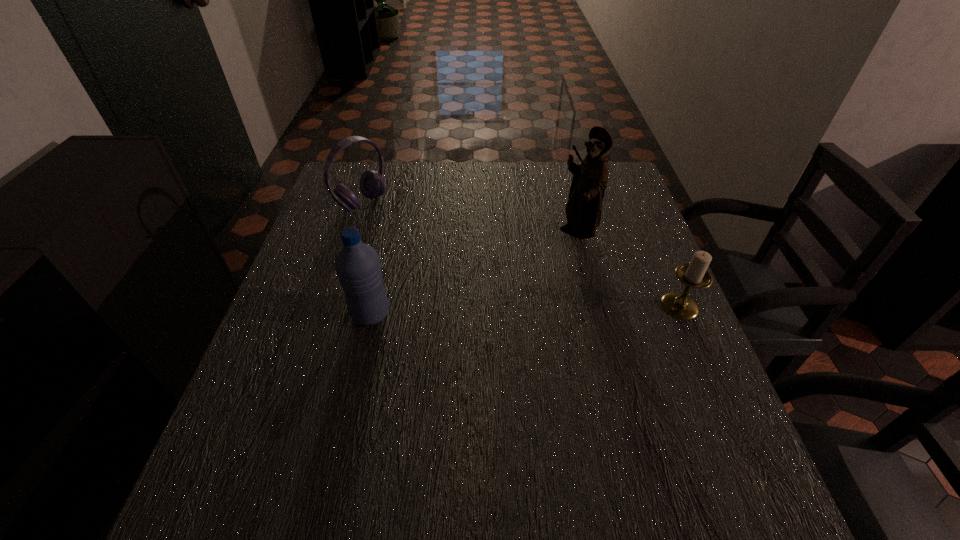
Locate an element on the screen. free space located 0.190m on the headband and ear cups of the headset is located at coordinates (420, 243).

Find the location of a particular element. The width and height of the screenshot is (960, 540). vacant space situated on the headband and ear cups of the headset is located at coordinates (416, 240).

Identify the location of vacant space situated 0.360m on the front-facing side of the tallest object. This screenshot has height=540, width=960. (516, 347).

Locate an element on the screen. The width and height of the screenshot is (960, 540). vacant space located on the front-facing side of the tallest object is located at coordinates (536, 311).

Where is `vacant space located 0.400m on the front-facing side of the tallest object`? vacant space located 0.400m on the front-facing side of the tallest object is located at coordinates (508, 361).

In order to click on object that is at the far edge in this screenshot , I will do `click(372, 183)`.

This screenshot has height=540, width=960. I want to click on water bottle at the left edge, so 357,265.

The height and width of the screenshot is (540, 960). What are the coordinates of `headset located at the left edge` in the screenshot? It's located at (372, 183).

Locate an element on the screen. The height and width of the screenshot is (540, 960). candle holder that is at the right edge is located at coordinates (680, 305).

Where is `figurine present at the right edge`? The height and width of the screenshot is (540, 960). figurine present at the right edge is located at coordinates (583, 210).